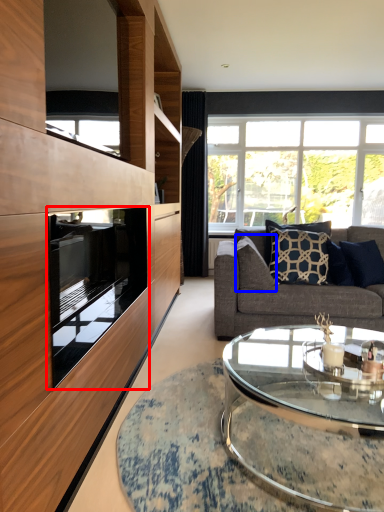
Question: Among these objects, which one is farthest to the camera, oven (highlighted by a red box) or pillow (highlighted by a blue box)?

Choices:
 (A) oven
 (B) pillow

Answer: (B)